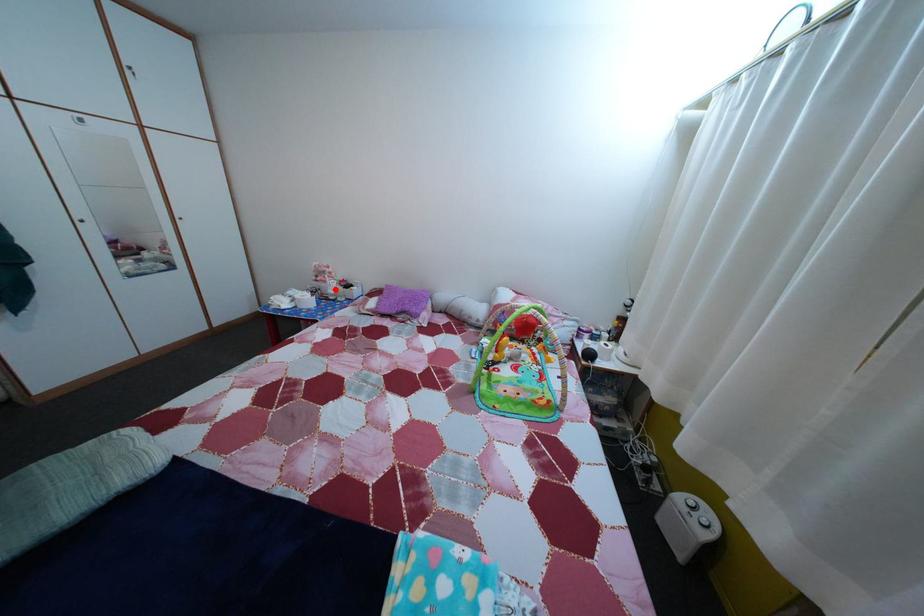
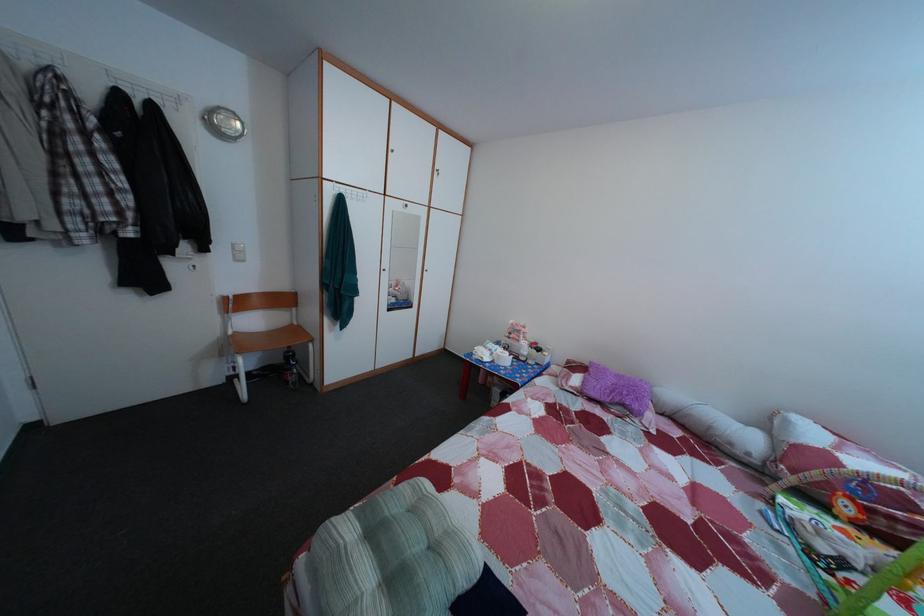
Question: I am providing you with two images of the same scene from different viewpoints. Given a red point in image1, look at the same physical point in image2. Is it:

Choices:
 (A) Closer to the viewpoint
 (B) Farther from the viewpoint

Answer: (B)